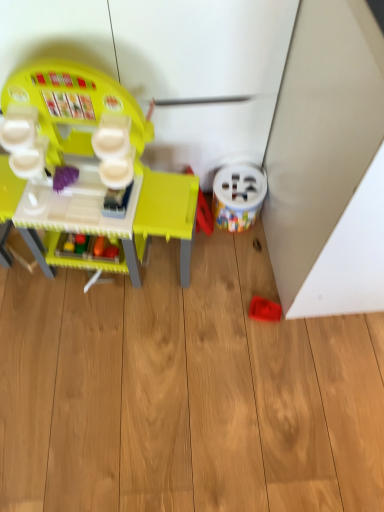
Locate an element on the screen. Image resolution: width=384 pixels, height=512 pixels. vacant area that is situated to the right of rubberized red toy at lower right, the 3th toy from the left is located at coordinates (321, 334).